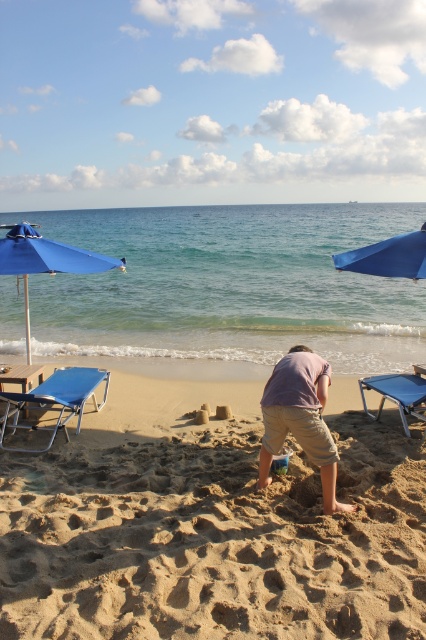
Question: Which point appears closest to the camera in this image?

Choices:
 (A) (400, 374)
 (B) (379, 268)
 (C) (40, 237)
 (D) (402, 237)

Answer: (B)

Question: Among these points, which one is farthest from the camera?

Choices:
 (A) (78, 424)
 (B) (28, 564)

Answer: (A)

Question: Does pink cotton shirt at center appear over blue fabric umbrella at upper center?

Choices:
 (A) yes
 (B) no

Answer: (B)

Question: Is fine-grained sand at center to the left of blue fabric umbrella at left from the viewer's perspective?

Choices:
 (A) no
 (B) yes

Answer: (A)

Question: Does pink cotton shirt at center appear over blue fabric umbrella at right?

Choices:
 (A) yes
 (B) no

Answer: (B)

Question: Among these points, which one is nearest to the camera?

Choices:
 (A) [x=356, y=259]
 (B) [x=310, y=436]
 (C) [x=408, y=406]
 (D) [x=71, y=400]

Answer: (B)